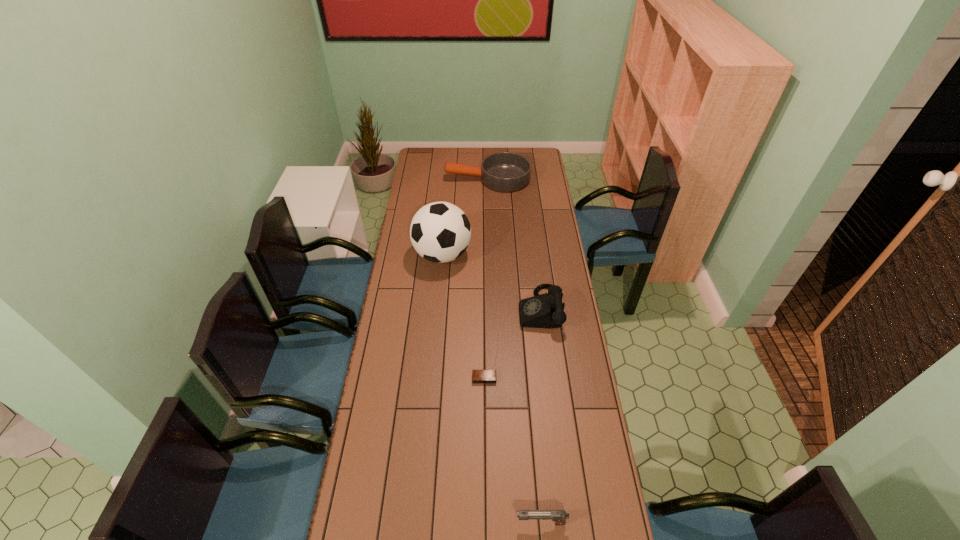
In order to click on the fourth nearest object in this screenshot , I will do `click(440, 232)`.

The image size is (960, 540). What are the coordinates of `soccer ball` in the screenshot? It's located at (440, 232).

This screenshot has height=540, width=960. I want to click on the fourth shortest object, so click(x=546, y=310).

Identify the location of telephone. Image resolution: width=960 pixels, height=540 pixels. (546, 310).

Where is `the farthest object`? This screenshot has height=540, width=960. the farthest object is located at coordinates click(x=505, y=171).

Where is `gun`? This screenshot has height=540, width=960. gun is located at coordinates (559, 516).

At what (x,y) coordinates should I click in order to perform the action: click on alarm clock. Please return your answer as a coordinate pair (x, y). The image size is (960, 540). Looking at the image, I should click on (478, 376).

This screenshot has height=540, width=960. What are the coordinates of `the shortest object` in the screenshot? It's located at (478, 376).

Identify the location of free space located 0.060m on the right of the soccer ball. Image resolution: width=960 pixels, height=540 pixels. (485, 255).

Find the location of a particular element. blank area located on the dial of the second tallest object is located at coordinates (490, 309).